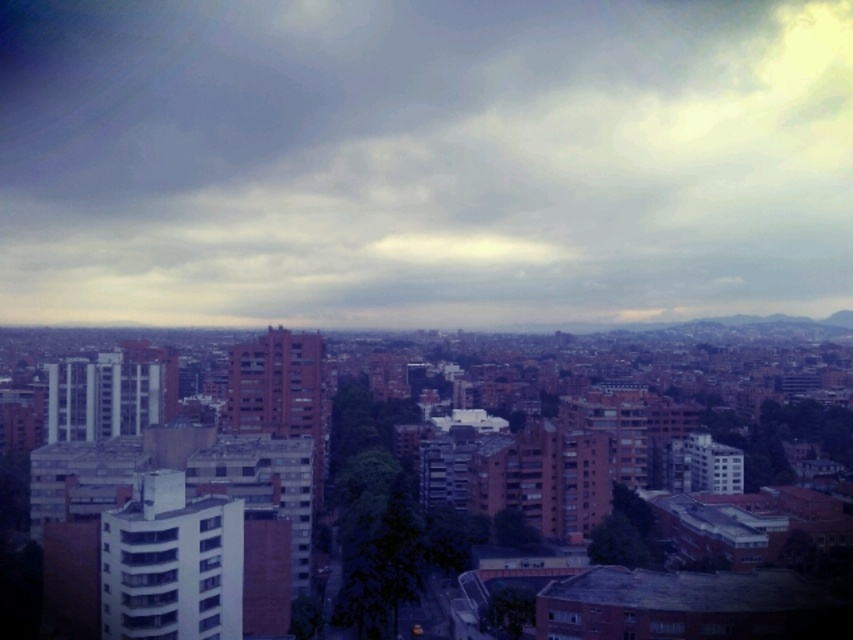
Based on the photo, you are an architect analyzing the cityscape. You need to determine which structure occupies more vertical space in the image. Based on the scene, which is taller between the cloudy sky at upper center and the matte brick building at center?

The cloudy sky at upper center is taller than the matte brick building at center, so the cloudy sky at upper center occupies more vertical space in the image.

Based on the cityscape image, which object occupies a larger portion of the scene between the cloudy sky at upper center and the matte brick building at center?

The matte brick building at center occupies a larger portion of the scene than the cloudy sky at upper center.

You are an architect reviewing a city model. You notice the cloudy sky at upper center and the matte brick building at center. Which object is positioned higher in the scene?

The cloudy sky at upper center is located above the matte brick building at center, so it is positioned higher in the scene.